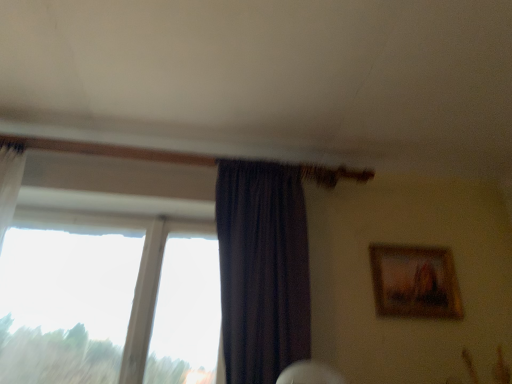
Question: Is dark purple sheer at center at the right side of wooden framed painting at upper right?

Choices:
 (A) yes
 (B) no

Answer: (B)

Question: Is dark purple sheer at center at the left side of wooden framed painting at upper right?

Choices:
 (A) yes
 (B) no

Answer: (A)

Question: Is dark purple sheer at center closer to the viewer compared to wooden framed painting at upper right?

Choices:
 (A) no
 (B) yes

Answer: (B)

Question: From a real-world perspective, is dark purple sheer at center under wooden framed painting at upper right?

Choices:
 (A) yes
 (B) no

Answer: (A)

Question: From the image's perspective, is dark purple sheer at center over wooden framed painting at upper right?

Choices:
 (A) no
 (B) yes

Answer: (B)

Question: Is dark purple sheer at center with wooden framed painting at upper right?

Choices:
 (A) no
 (B) yes

Answer: (A)

Question: From a real-world perspective, is wooden framed painting at upper right positioned over transparent glass window at left based on gravity?

Choices:
 (A) no
 (B) yes

Answer: (B)

Question: Does wooden framed painting at upper right have a greater width compared to transparent glass window at left?

Choices:
 (A) no
 (B) yes

Answer: (A)

Question: Considering the relative positions of wooden framed painting at upper right and transparent glass window at left in the image provided, is wooden framed painting at upper right to the right of transparent glass window at left from the viewer's perspective?

Choices:
 (A) yes
 (B) no

Answer: (A)

Question: Can you confirm if wooden framed painting at upper right is taller than transparent glass window at left?

Choices:
 (A) yes
 (B) no

Answer: (B)

Question: Is wooden framed painting at upper right smaller than transparent glass window at left?

Choices:
 (A) no
 (B) yes

Answer: (B)

Question: From the image's perspective, is wooden framed painting at upper right on transparent glass window at left?

Choices:
 (A) no
 (B) yes

Answer: (B)

Question: From a real-world perspective, is wooden framed painting at upper right over dark purple sheer at center?

Choices:
 (A) yes
 (B) no

Answer: (A)